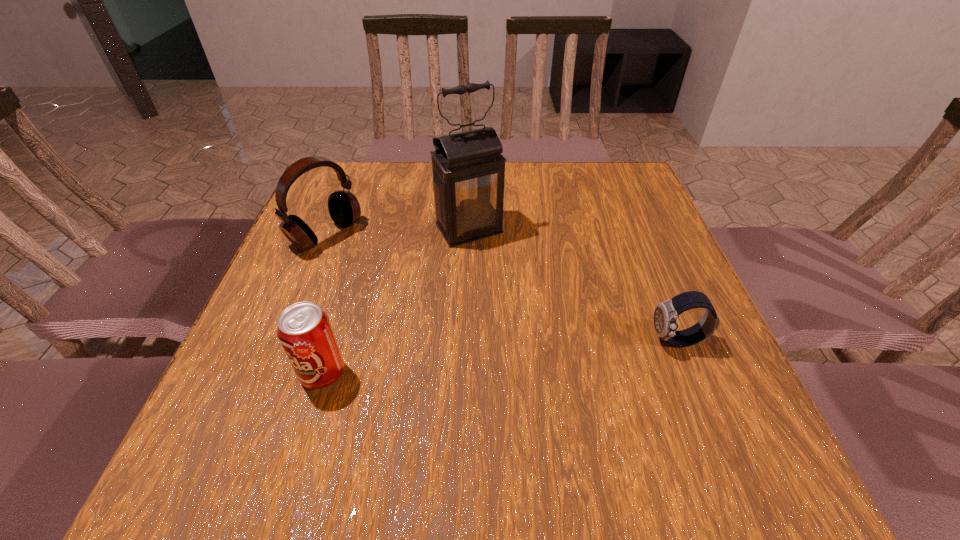
At what (x,y) coordinates should I click in order to perform the action: click on soda. Please return your answer as a coordinate pair (x, y). This screenshot has width=960, height=540. Looking at the image, I should click on (304, 330).

The width and height of the screenshot is (960, 540). Find the location of `the shortest object`. the shortest object is located at coordinates (666, 313).

You are a GUI agent. You are given a task and a screenshot of the screen. Output one action in this format:
    pyautogui.click(x=<x>, y=<y>)
    Task: Click on the rightmost object
    This screenshot has height=540, width=960.
    Given the screenshot: What is the action you would take?
    pyautogui.click(x=666, y=313)

At what (x,y) coordinates should I click in order to perform the action: click on the tallest object. Please return your answer as a coordinate pair (x, y). This screenshot has width=960, height=540. Looking at the image, I should click on (468, 168).

Find the location of a particular element. This screenshot has height=540, width=960. lantern is located at coordinates (468, 168).

Identify the location of the third shortest object. Image resolution: width=960 pixels, height=540 pixels. coord(344,208).

Find the location of a particular element. vacant area situated 0.100m on the back of the third tallest object is located at coordinates (341, 315).

Find the location of a particular element. vacant space located 0.200m on the face of the watch is located at coordinates (546, 341).

Find the location of a particular element. The width and height of the screenshot is (960, 540). vacant area situated 0.120m on the face of the watch is located at coordinates (588, 341).

This screenshot has width=960, height=540. Identify the location of vacant space located on the face of the watch. (540, 341).